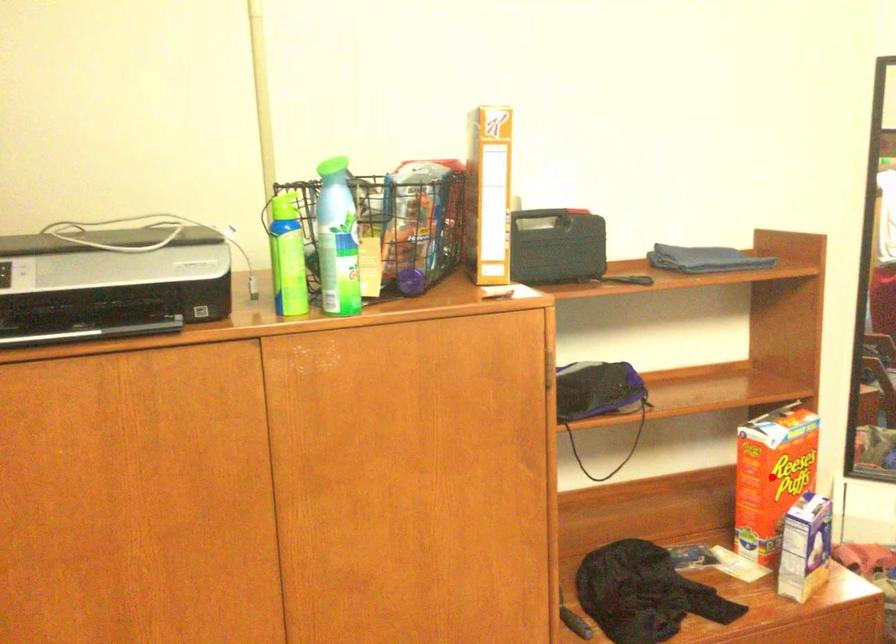
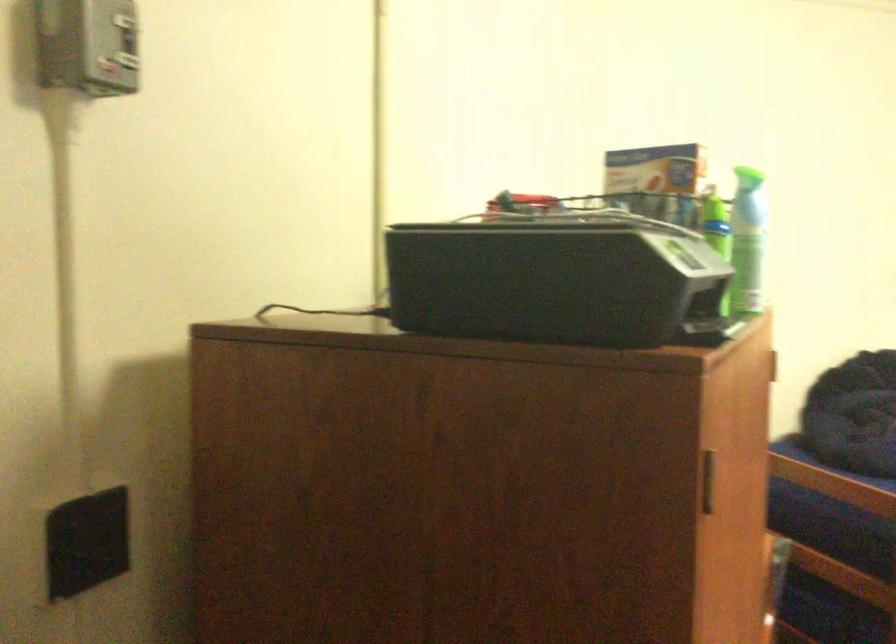
Question: I am providing you with two images of the same scene from different viewpoints. A red point is marked on the first image. At the location where the point appears in image 1, is it still visible in image 2?

Choices:
 (A) Yes
 (B) No

Answer: (B)